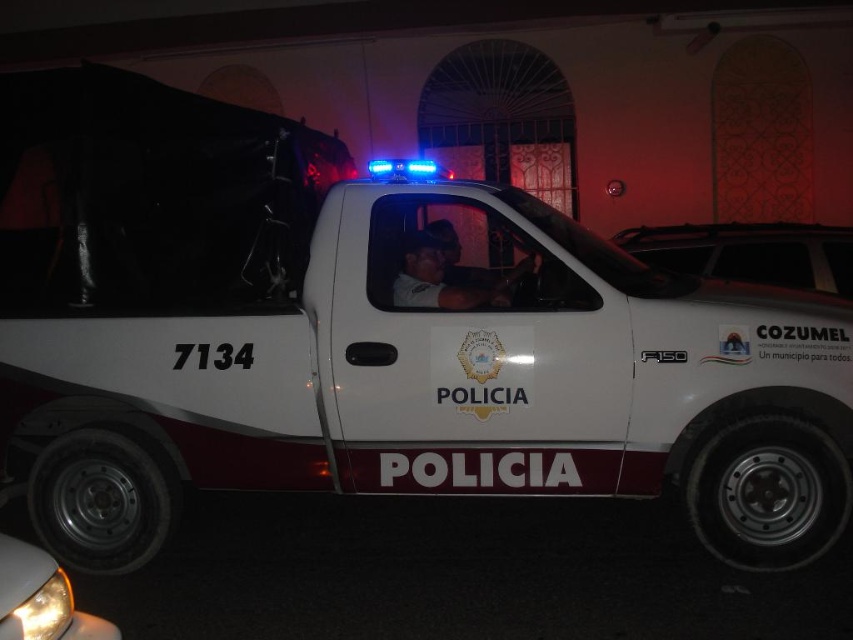
Question: Which object is farther from the camera taking this photo?

Choices:
 (A) matte gray uniform at center
 (B) white matte windshield at upper center
 (C) yellow plastic headlight at lower left

Answer: (B)

Question: Which of the following is the farthest from the observer?

Choices:
 (A) matte gray uniform at center
 (B) yellow plastic headlight at lower left

Answer: (A)

Question: Can you confirm if white matte windshield at upper center is positioned above yellow plastic headlight at lower left?

Choices:
 (A) yes
 (B) no

Answer: (A)

Question: Which of the following is the closest to the observer?

Choices:
 (A) (445, 237)
 (B) (660, 259)

Answer: (A)

Question: Can you confirm if white matte windshield at upper center is positioned below matte gray uniform at center?

Choices:
 (A) no
 (B) yes

Answer: (A)

Question: Is white matte windshield at upper center below matte gray uniform at center?

Choices:
 (A) yes
 (B) no

Answer: (B)